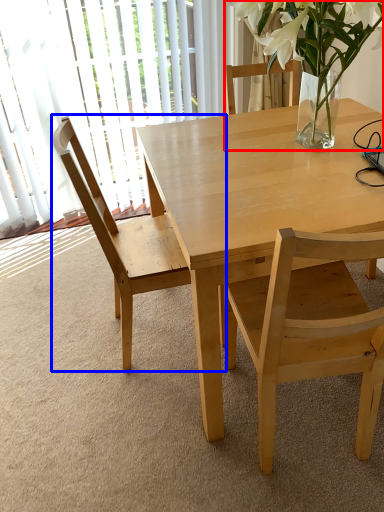
Question: Which point is further to the camera, houseplant (highlighted by a red box) or chair (highlighted by a blue box)?

Choices:
 (A) houseplant
 (B) chair

Answer: (B)